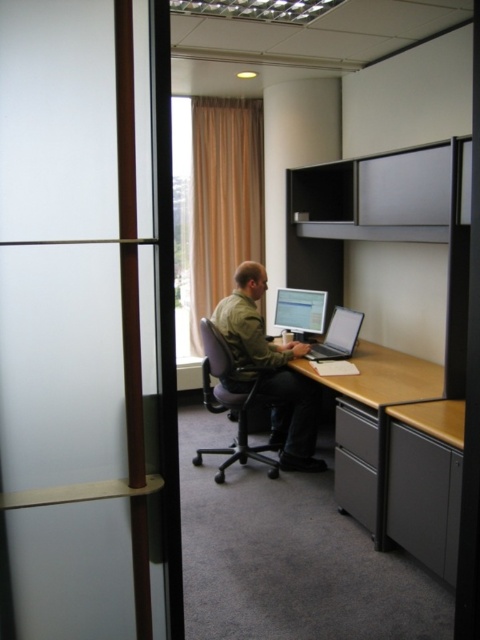
Which of these two, wooden desk at lower right or matte black monitor at center, stands shorter?

With less height is matte black monitor at center.

In order to click on wooden desk at lower right in this screenshot , I will do `click(425, 483)`.

Identify the location of wooden desk at lower right. (425, 483).

At what (x,y) coordinates should I click in order to perform the action: click on wooden desk at lower right. Please return your answer as a coordinate pair (x, y). Image resolution: width=480 pixels, height=640 pixels. Looking at the image, I should click on (425, 483).

Who is shorter, wooden desk at lower right or wooden at center?

Standing shorter between the two is wooden desk at lower right.

Based on the photo, is wooden desk at lower right thinner than wooden at center?

Indeed, wooden desk at lower right has a lesser width compared to wooden at center.

You are a GUI agent. You are given a task and a screenshot of the screen. Output one action in this format:
    pyautogui.click(x=<x>, y=<y>)
    Task: Click on the wooden desk at lower right
    The height and width of the screenshot is (640, 480).
    Given the screenshot: What is the action you would take?
    pyautogui.click(x=425, y=483)

Can you confirm if green matte jacket at center is taller than matte black monitor at center?

Indeed, green matte jacket at center has a greater height compared to matte black monitor at center.

Who is more distant from viewer, (228, 333) or (289, 317)?

The point (289, 317) is behind.

Is point (284, 353) behind point (278, 324)?

No.

The height and width of the screenshot is (640, 480). I want to click on green matte jacket at center, so click(269, 371).